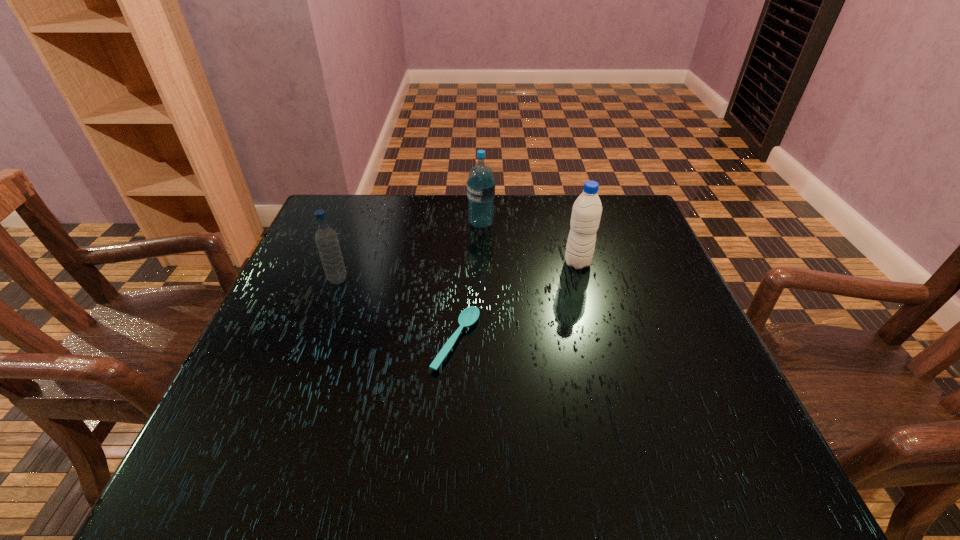
I want to click on vacant space located on the left of the leftmost water bottle, so click(288, 280).

You are a GUI agent. You are given a task and a screenshot of the screen. Output one action in this format:
    pyautogui.click(x=<x>, y=<y>)
    Task: Click on the vacant area located 0.340m on the back of the shortest object
    This screenshot has width=960, height=540.
    Given the screenshot: What is the action you would take?
    pyautogui.click(x=463, y=222)

Where is `object that is at the far edge`? The width and height of the screenshot is (960, 540). object that is at the far edge is located at coordinates (481, 185).

Find the location of a particular element. The image size is (960, 540). object that is at the left edge is located at coordinates (326, 238).

What are the coordinates of `free location at the far edge` in the screenshot? It's located at (571, 209).

This screenshot has width=960, height=540. I want to click on vacant space at the near edge of the desktop, so click(x=420, y=485).

The image size is (960, 540). In the image, there is a desktop. In order to click on vacant space at the left edge in this screenshot , I will do `click(237, 373)`.

In the image, there is a desktop. Identify the location of free space at the right edge. (668, 272).

Where is `blank space at the far left corner`? The width and height of the screenshot is (960, 540). blank space at the far left corner is located at coordinates (369, 198).

In the image, there is a desktop. Where is `vacant region at the far right corner`? The image size is (960, 540). vacant region at the far right corner is located at coordinates (642, 220).